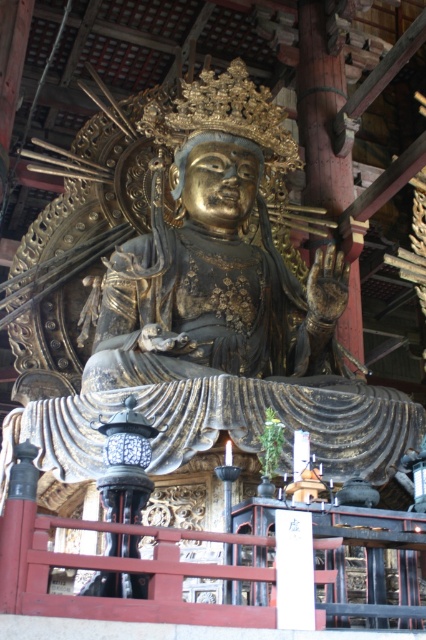
You are standing in front of the statue in the temple. You notice a specific point marked at coordinates [204,308]. What object is located at this point?

The gold bronze statue at center is located at point [204,308].